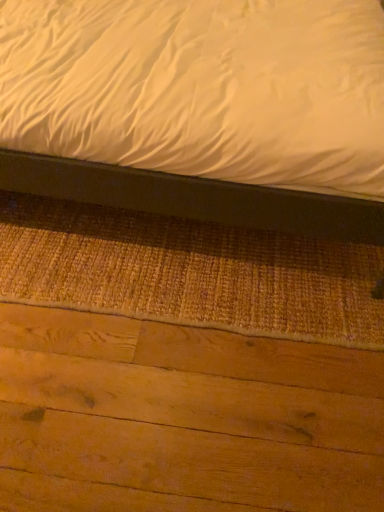
Question: Is matte black bed at upper center at the left side of natural wood plywood at bottom?

Choices:
 (A) no
 (B) yes

Answer: (B)

Question: Is matte black bed at upper center surrounding natural wood plywood at bottom?

Choices:
 (A) no
 (B) yes

Answer: (A)

Question: From a real-world perspective, is matte black bed at upper center under natural wood plywood at bottom?

Choices:
 (A) no
 (B) yes

Answer: (A)

Question: Considering the relative sizes of matte black bed at upper center and natural wood plywood at bottom in the image provided, is matte black bed at upper center bigger than natural wood plywood at bottom?

Choices:
 (A) no
 (B) yes

Answer: (B)

Question: Is matte black bed at upper center taller than natural wood plywood at bottom?

Choices:
 (A) no
 (B) yes

Answer: (B)

Question: Does matte black bed at upper center have a lesser width compared to natural wood plywood at bottom?

Choices:
 (A) yes
 (B) no

Answer: (B)

Question: Is natural wood plywood at bottom beside matte black bed at upper center?

Choices:
 (A) yes
 (B) no

Answer: (B)

Question: Does natural wood plywood at bottom have a larger size compared to matte black bed at upper center?

Choices:
 (A) no
 (B) yes

Answer: (A)

Question: Would you say natural wood plywood at bottom is a long distance from matte black bed at upper center?

Choices:
 (A) yes
 (B) no

Answer: (B)

Question: From the image's perspective, does natural wood plywood at bottom appear lower than matte black bed at upper center?

Choices:
 (A) no
 (B) yes

Answer: (B)

Question: From the image's perspective, is natural wood plywood at bottom on top of matte black bed at upper center?

Choices:
 (A) no
 (B) yes

Answer: (A)

Question: From a real-world perspective, does natural wood plywood at bottom stand above matte black bed at upper center?

Choices:
 (A) no
 (B) yes

Answer: (A)

Question: Is matte black bed at upper center wider or thinner than natural wood plywood at bottom?

Choices:
 (A) wide
 (B) thin

Answer: (A)